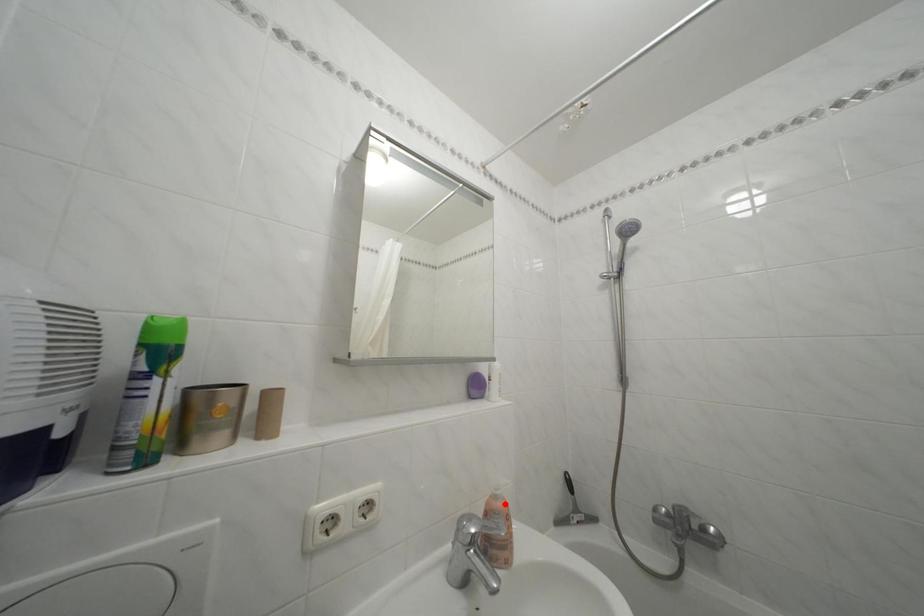
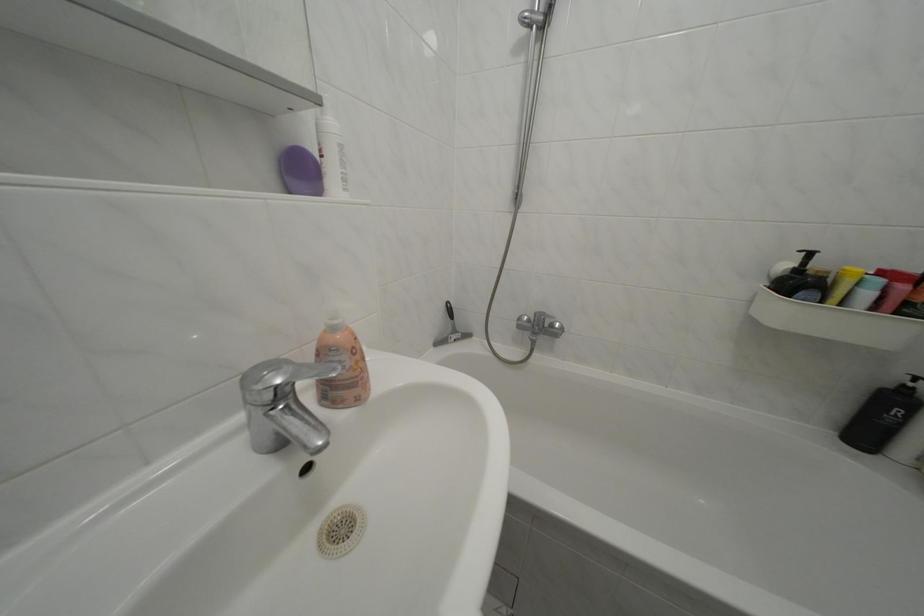
Where in the second image is the point corresponding to the highlighted location from the first image?

(342, 334)